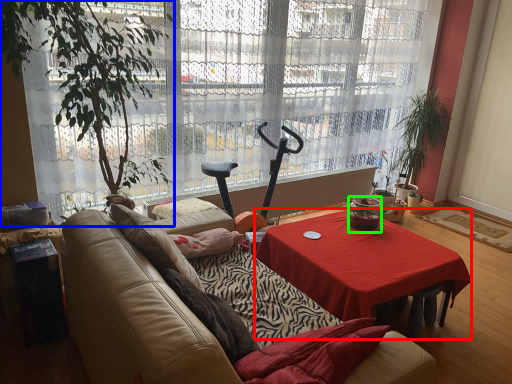
Question: Which object is the closest to the desk (highlighted by a red box)? Choose among these: houseplant (highlighted by a blue box) or coffee cup (highlighted by a green box).

Choices:
 (A) houseplant
 (B) coffee cup

Answer: (B)